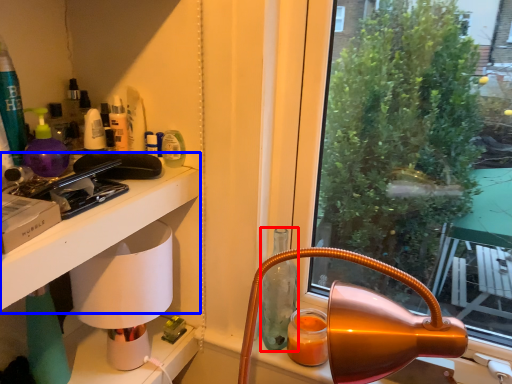
Question: Which object is further to the camera taking this photo, bottle (highlighted by a red box) or table (highlighted by a blue box)?

Choices:
 (A) bottle
 (B) table

Answer: (A)